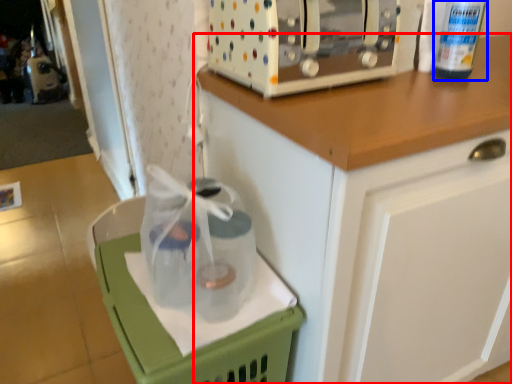
Question: Which point is further to the camera, cabinetry (highlighted by a red box) or bottle (highlighted by a blue box)?

Choices:
 (A) cabinetry
 (B) bottle

Answer: (B)